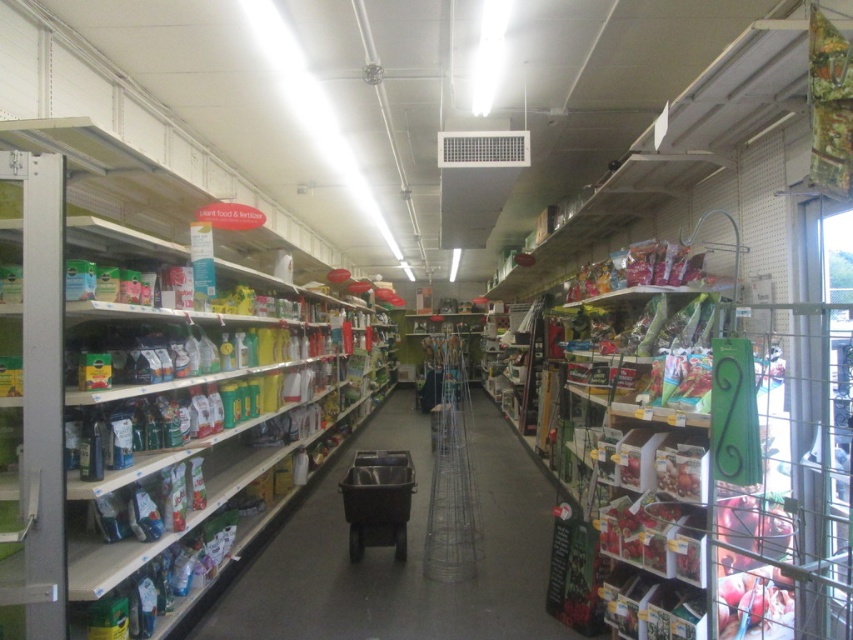
You are a customer in the gardening section of a store. You need to place a large bag of soil next to the metallic silver shelves at left and the green matte plant food at center. Which object should you place it next to if you want to maximize the space used efficiently?

The metallic silver shelves at left is larger in size than the green matte plant food at center, so placing the large bag of soil next to the metallic silver shelves at left would utilize the available space more efficiently.

You are a customer in the gardening section of a store. You see the green matte plant food at center and the metallic gray shopping cart at center. Which item is shorter?

The green matte plant food at center is shorter than the metallic gray shopping cart at center.

You are a customer in the store and want to place a large bag of fertilizer from the metallic silver shelves at left into the metallic gray shopping cart at center. Can you fit the bag into the cart without removing any items?

The metallic silver shelves at left is bigger than metallic gray shopping cart at center, so the bag from the shelves may not fit into the cart since the cart is smaller.